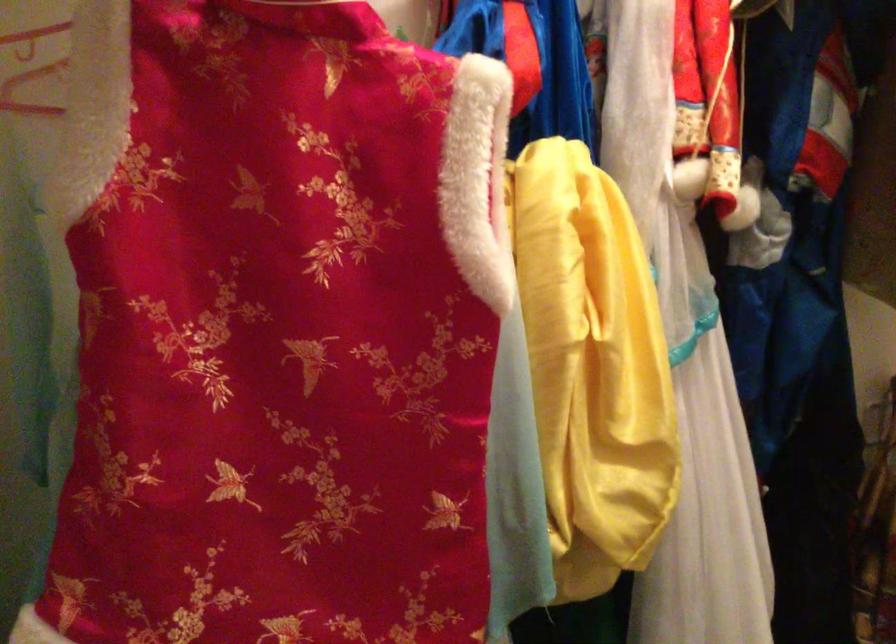
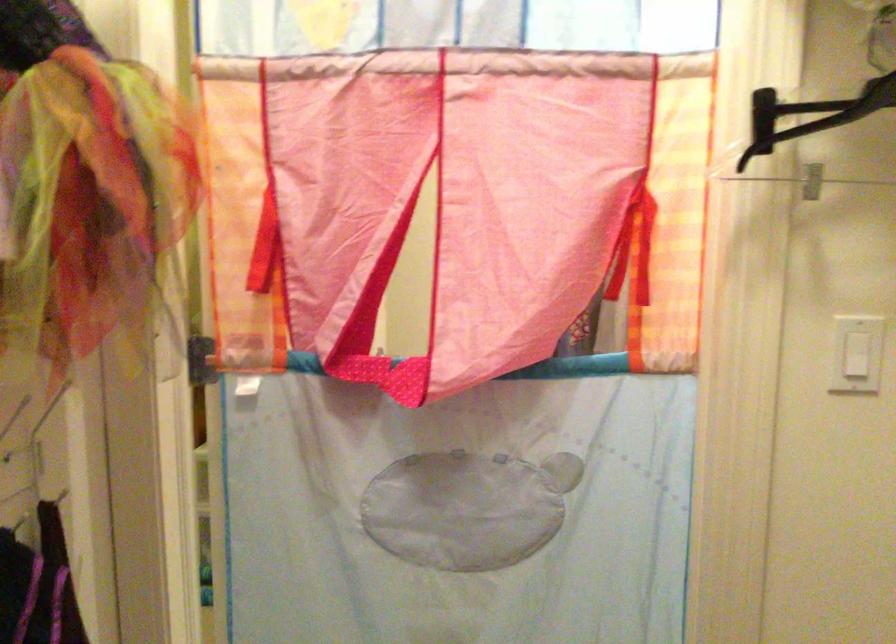
Question: The camera is either moving clockwise (left) or counter-clockwise (right) around the object. The first image is from the beginning of the video and the second image is from the end. Is the camera moving left or right when shooting the video?

Choices:
 (A) Left
 (B) Right

Answer: (A)